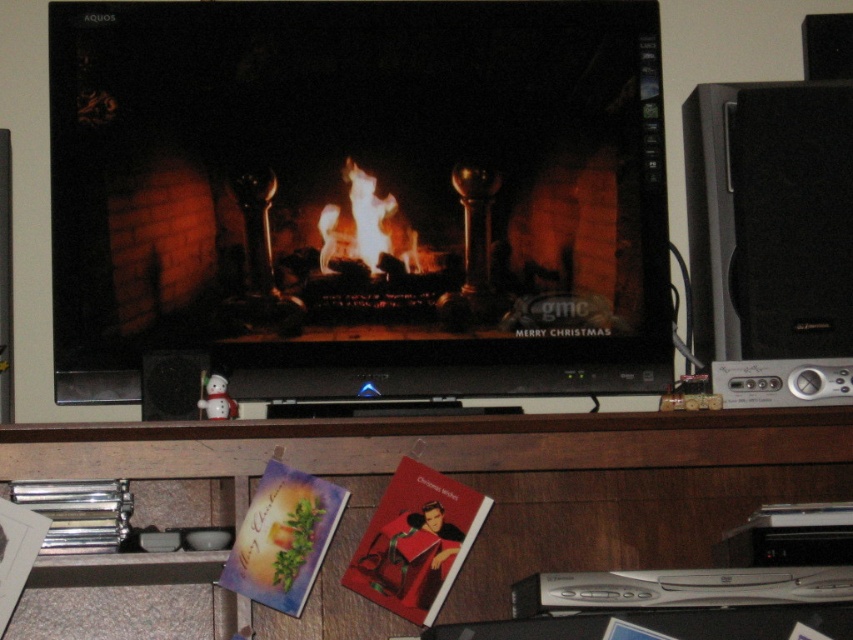
Between matte black fireplace at center and flamematerial/texture at center, which one appears on the right side from the viewer's perspective?

Positioned to the right is flamematerial/texture at center.

Locate an element on the screen. This screenshot has height=640, width=853. matte black fireplace at center is located at coordinates (360, 196).

Which is in front, point (315, 358) or point (676, 557)?

Point (315, 358) is more forward.

Describe the element at coordinates (360, 196) in the screenshot. I see `matte black fireplace at center` at that location.

The image size is (853, 640). In order to click on matte black fireplace at center in this screenshot , I will do `click(360, 196)`.

Who is positioned more to the left, wooden entertainment center at lower center or flamematerial/texture at center?

Positioned to the left is flamematerial/texture at center.

Which is below, wooden entertainment center at lower center or flamematerial/texture at center?

Positioned lower is wooden entertainment center at lower center.

Who is more distant from viewer, (221,504) or (416,269)?

Positioned behind is point (221,504).

The image size is (853, 640). Find the location of `wooden entertainment center at lower center`. wooden entertainment center at lower center is located at coordinates (483, 486).